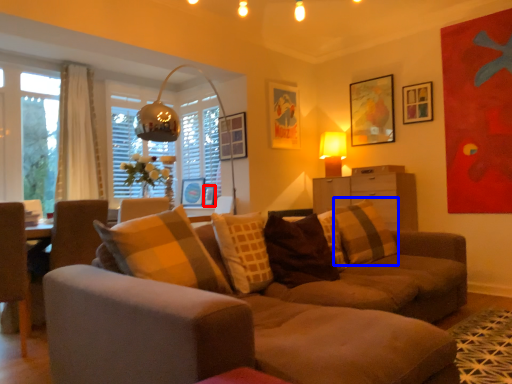
Question: Which object is closer to the camera taking this photo, picture frame (highlighted by a red box) or pillow (highlighted by a blue box)?

Choices:
 (A) picture frame
 (B) pillow

Answer: (B)